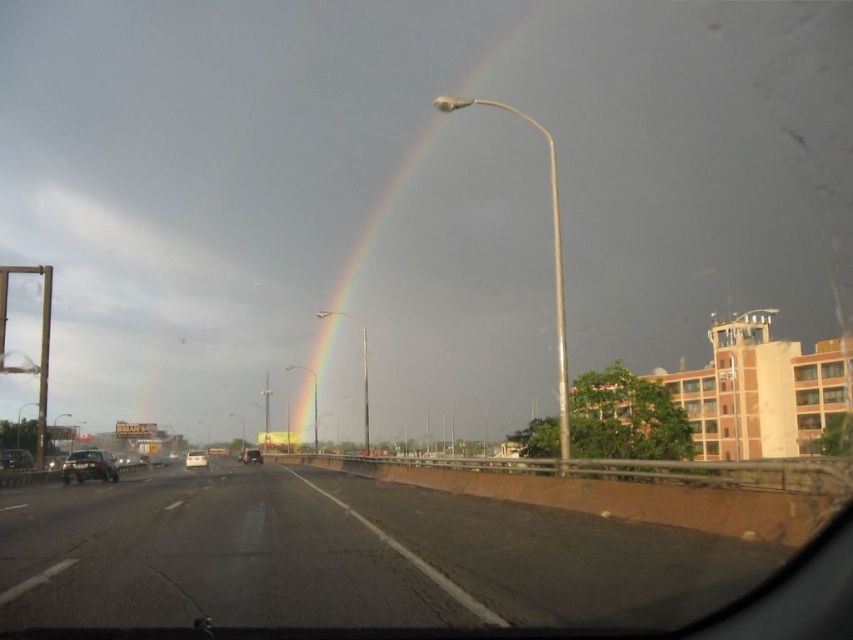
Is matte black car at left closer to the viewer compared to shiny black sedan at left?

That is True.

Between matte black car at left and shiny black sedan at left, which one is positioned higher?

Positioned higher is matte black car at left.

Image resolution: width=853 pixels, height=640 pixels. Describe the element at coordinates (90, 467) in the screenshot. I see `matte black car at left` at that location.

The height and width of the screenshot is (640, 853). What are the coordinates of `matte black car at left` in the screenshot? It's located at (90, 467).

Is rainbow at upper center to the right of metallic silver car at center from the viewer's perspective?

Yes, rainbow at upper center is to the right of metallic silver car at center.

Which is in front, point (363, 250) or point (254, 460)?

Point (254, 460) is in front.

The width and height of the screenshot is (853, 640). Describe the element at coordinates (380, 214) in the screenshot. I see `rainbow at upper center` at that location.

Locate an element on the screen. The height and width of the screenshot is (640, 853). rainbow at upper center is located at coordinates (380, 214).

Does point (561, 387) come closer to viewer compared to point (196, 454)?

Yes.

Describe the element at coordinates (380, 214) in the screenshot. I see `rainbow at upper center` at that location.

The height and width of the screenshot is (640, 853). What are the coordinates of `rainbow at upper center` in the screenshot? It's located at click(380, 214).